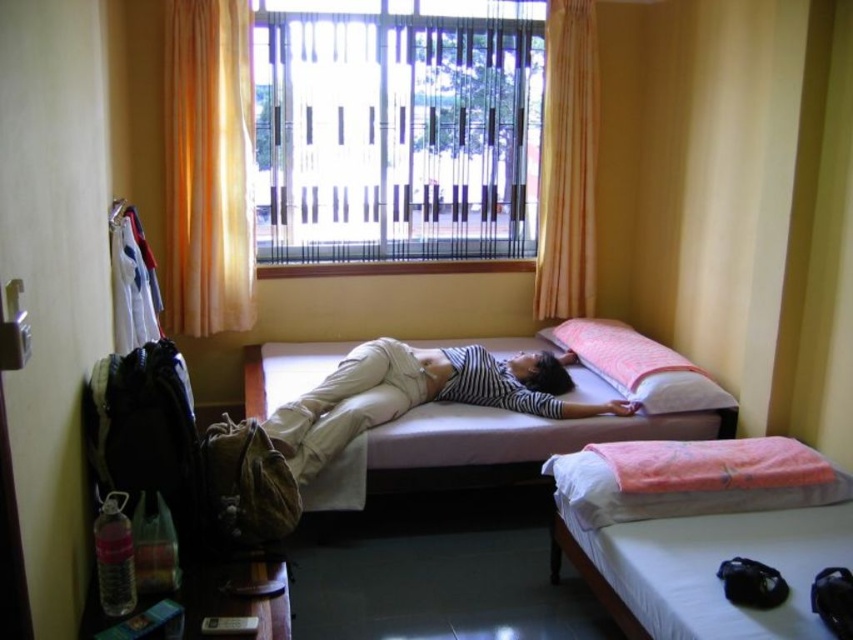
Question: Does yellow fabric curtain at upper center appear over pink fabric pillow at center?

Choices:
 (A) yes
 (B) no

Answer: (A)

Question: Considering the real-world distances, which object is closest to the orange fabric pillow at lower right?

Choices:
 (A) pink fabric pillow at center
 (B) white cotton bed at lower right
 (C) orange fabric curtain at upper center

Answer: (B)

Question: Which point is closer to the camera taking this photo?

Choices:
 (A) (535, 276)
 (B) (436, 218)
 (C) (584, 324)
 (D) (216, 154)

Answer: (D)

Question: Which point is closer to the camera?

Choices:
 (A) (x=654, y=513)
 (B) (x=514, y=32)
 (C) (x=570, y=4)
 (D) (x=202, y=13)

Answer: (A)

Question: From the image, what is the correct spatial relationship of transparent plastic window at center in relation to orange fabric pillow at lower right?

Choices:
 (A) below
 (B) above

Answer: (B)

Question: Does mattress at center have a greater width compared to orange fabric curtain at upper center?

Choices:
 (A) yes
 (B) no

Answer: (A)